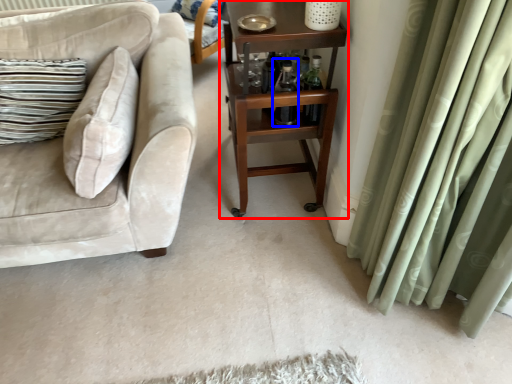
Question: Among these objects, which one is farthest to the camera, table (highlighted by a red box) or bottle (highlighted by a blue box)?

Choices:
 (A) table
 (B) bottle

Answer: (B)